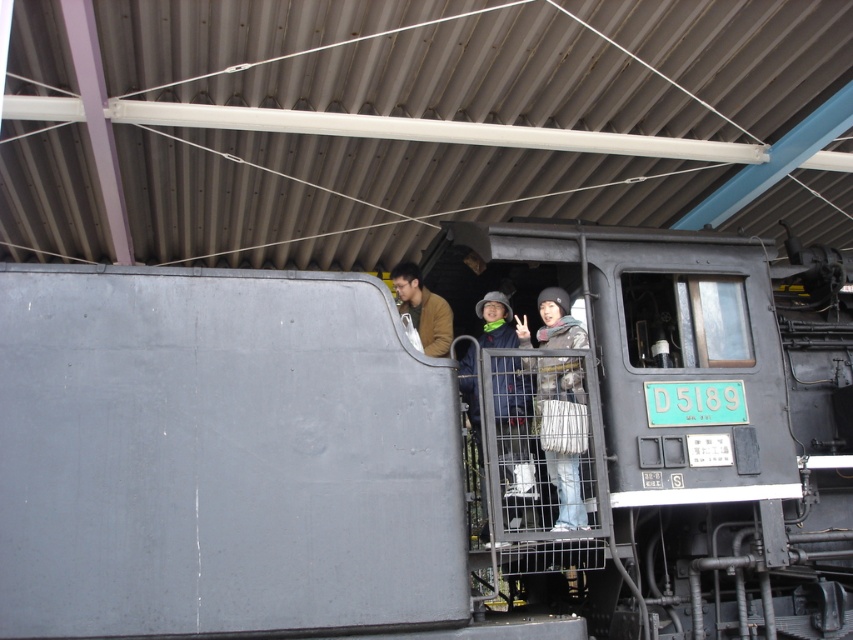
You are a photographer trying to capture a photo of the matte black train at center and the matte gray jacket at center. Based on their widths, which object should you frame first in your camera viewfinder to ensure both fit in the shot?

The matte black train at center is wider than the matte gray jacket at center. To ensure both fit in the shot, you should frame the wider matte black train at center first and then adjust the viewfinder to include the narrower matte gray jacket at center.